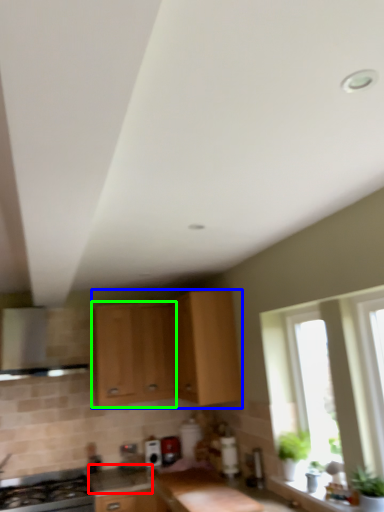
Question: Considering the real-world distances, which object is farthest from counter top (highlighted by a red box)? cabinetry (highlighted by a blue box) or cabinetry (highlighted by a green box)?

Choices:
 (A) cabinetry
 (B) cabinetry

Answer: (B)